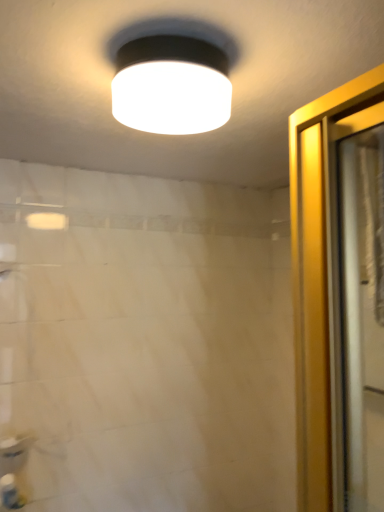
Question: Which is correct: white matte lampshade at upper center is inside white plastic bottle at lower left, or outside of it?

Choices:
 (A) inside
 (B) outside

Answer: (B)

Question: In terms of size, does white matte lampshade at upper center appear bigger or smaller than white plastic bottle at lower left?

Choices:
 (A) small
 (B) big

Answer: (B)

Question: Based on their relative distances, which object is farther from the white plastic bottle at lower left?

Choices:
 (A) white glossy sink at lower left
 (B) translucent plastic shower curtain at right
 (C) white matte lampshade at upper center

Answer: (B)

Question: Estimate the real-world distances between objects in this image. Which object is closer to the white glossy sink at lower left?

Choices:
 (A) white matte lampshade at upper center
 (B) translucent plastic shower curtain at right
 (C) white plastic bottle at lower left

Answer: (C)